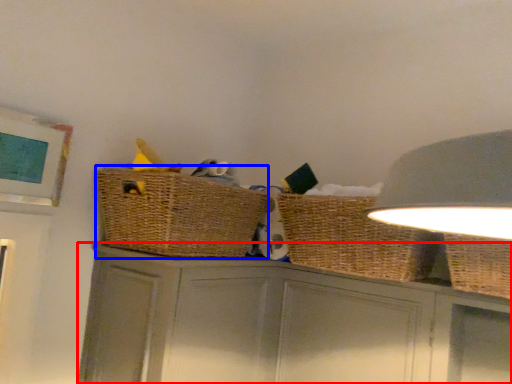
Question: Among these objects, which one is nearest to the camera, cabinetry (highlighted by a red box) or basket container (highlighted by a blue box)?

Choices:
 (A) cabinetry
 (B) basket container

Answer: (A)